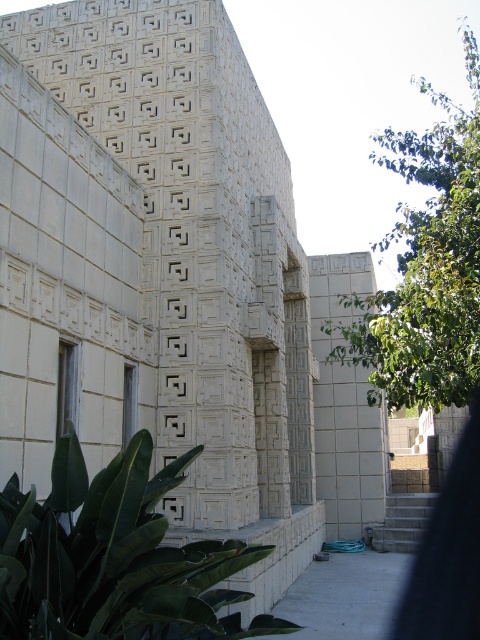
The height and width of the screenshot is (640, 480). I want to click on green leafy plant at lower left, so click(115, 557).

Between green leafy plant at lower left and green leafy plant at right, which one is positioned lower?

green leafy plant at lower left is lower down.

Which is behind, point (211, 566) or point (420, 294)?

Point (420, 294)

I want to click on green leafy plant at lower left, so click(x=115, y=557).